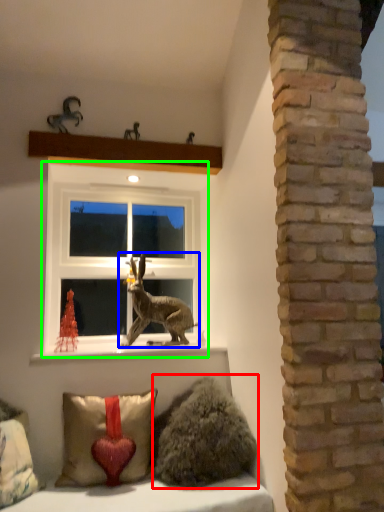
Question: Which is farther away from animal (highlighted by a red box)? animal (highlighted by a blue box) or window (highlighted by a green box)?

Choices:
 (A) animal
 (B) window

Answer: (B)